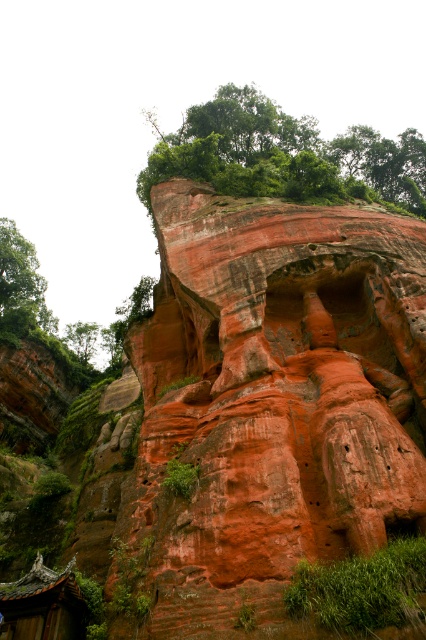
Question: Does green leafy tree at left appear on the right side of green leafy tree at upper left?

Choices:
 (A) no
 (B) yes

Answer: (B)

Question: Is green leafy tree at upper center closer to the viewer compared to green leafy tree at left?

Choices:
 (A) yes
 (B) no

Answer: (A)

Question: Which object is farther from the camera taking this photo?

Choices:
 (A) reddish-brown stone carving at upper center
 (B) green leafy tree at upper left
 (C) green leafy tree at upper center

Answer: (B)

Question: Is green leafy tree at upper center further to the viewer compared to green leafy tree at left?

Choices:
 (A) no
 (B) yes

Answer: (A)

Question: Which of the following is the closest to the observer?

Choices:
 (A) (29, 580)
 (B) (321, 508)

Answer: (B)

Question: Which of the following is the farthest from the observer?

Choices:
 (A) (412, 145)
 (B) (46, 324)

Answer: (B)